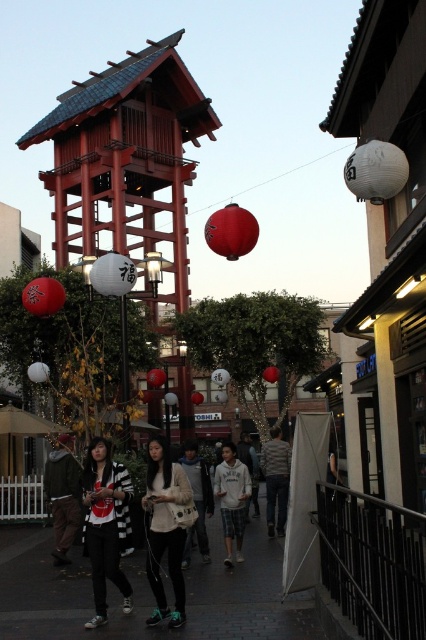
Question: Among these points, which one is nearest to the camera?

Choices:
 (A) pos(147,548)
 (B) pos(273,461)
 (C) pos(57,474)
 (D) pos(253,464)

Answer: (A)

Question: Does matte white sweater at center appear on the left side of white fuzzy jacket at center?

Choices:
 (A) yes
 (B) no

Answer: (A)

Question: Considering the relative positions of striped sweater at center and white cotton hoodie at center in the image provided, where is striped sweater at center located with respect to white cotton hoodie at center?

Choices:
 (A) above
 (B) below

Answer: (A)

Question: Considering the real-world distances, which object is closest to the white matte hoodie at center?

Choices:
 (A) green fuzzy jacket at lower left
 (B) matte black jacket at center

Answer: (B)

Question: Does striped sweater at center lie in front of white cotton hoodie at center?

Choices:
 (A) yes
 (B) no

Answer: (B)

Question: Estimate the real-world distances between objects in this image. Which object is farther from the striped sweater at center?

Choices:
 (A) matte white sweater at center
 (B) matte black jacket at center

Answer: (B)